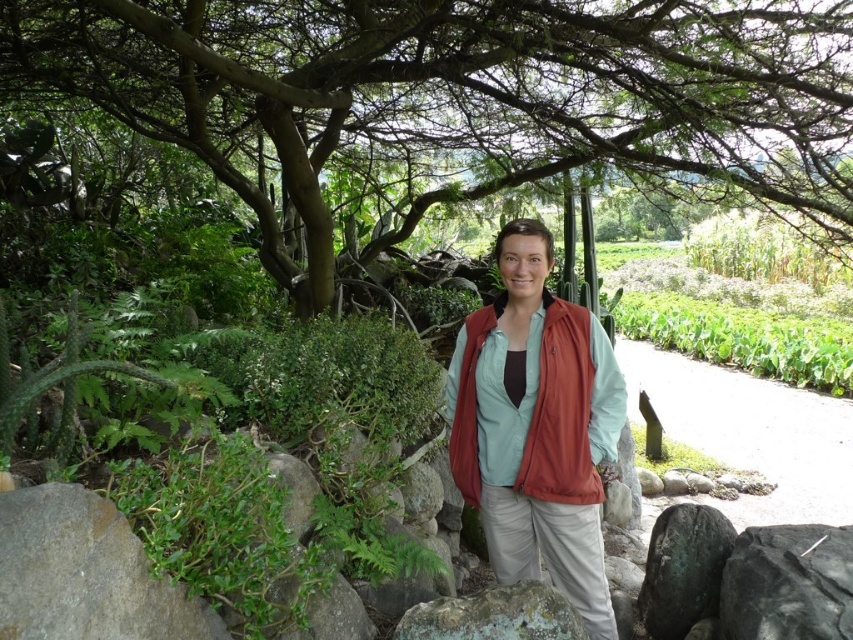
You are standing at the point with coordinates point (727,412) and want to walk to point (538,426). Which direction should you move relative to your current position?

Since point (727,412) is further to the viewer than point (538,426), you should move forward to reach point (538,426).

You are a gardener who wants to plant a new flower bed. The flower bed requires an area that is taller than the white gravel path at lower right. Can you use the space near the green leafy tree at center for this purpose?

The green leafy tree at center is taller than the white gravel path at lower right, so yes, the space near the green leafy tree at center can be used for the flower bed since it meets the height requirement.

You are a gardener who wants to plant a new bush between the green leafy tree at center and the white gravel path at lower right. Based on their positions, which object should the bush be closer to?

The green leafy tree at center is in front of the white gravel path at lower right, so the bush should be placed closer to the white gravel path at lower right to maintain proper spacing.